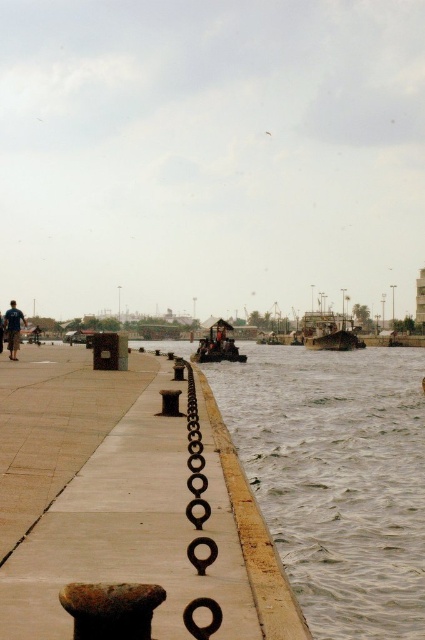
Who is more forward, (243,390) or (201,564)?

Point (201,564) is more forward.

Does brown/rough water at center have a larger size compared to rusty metal chain at center?

Yes, brown/rough water at center is bigger than rusty metal chain at center.

Who is more forward, (328, 397) or (206, 506)?

Positioned in front is point (206, 506).

Find the location of a particular element. This screenshot has width=425, height=640. brown/rough water at center is located at coordinates (337, 477).

Is rusty metal boat at center further to camera compared to blue denim shorts at left?

Yes.

Consider the image. Who is shorter, rusty metal boat at center or blue denim shorts at left?

blue denim shorts at left is shorter.

Who is more forward, (340, 330) or (11, 349)?

Point (11, 349)

Where is `rusty metal boat at center`? rusty metal boat at center is located at coordinates (328, 332).

Who is shorter, brown/rough water at center or rusty metal boat at center?

With less height is brown/rough water at center.

Is brown/rough water at center positioned in front of rusty metal boat at center?

Yes, brown/rough water at center is in front of rusty metal boat at center.

Does point (326, 392) lie in front of point (343, 321)?

Yes, point (326, 392) is in front of point (343, 321).

At what (x,y) coordinates should I click in order to perform the action: click on brown/rough water at center. Please return your answer as a coordinate pair (x, y). This screenshot has width=425, height=640. Looking at the image, I should click on (337, 477).